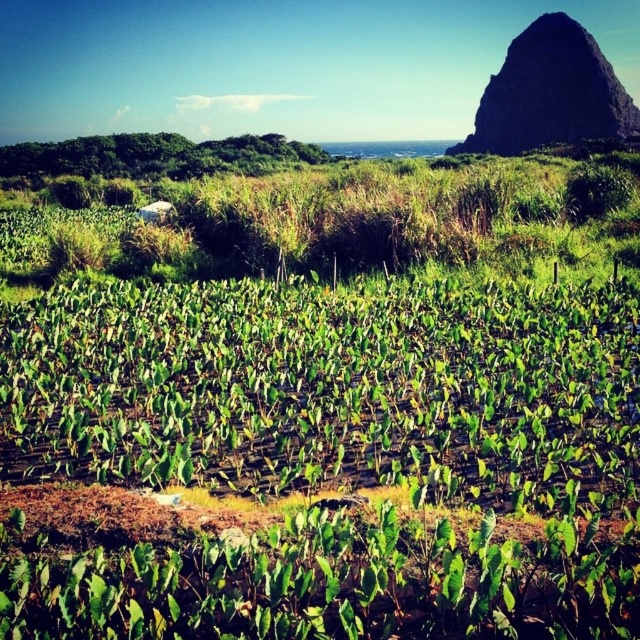
You are a farmer planning to plant new crops in the field. You notice the green leafy plants at center and the dark brown rocky peak at upper right. Which object is positioned higher in the image?

The dark brown rocky peak at upper right is positioned higher in the image than the green leafy plants at center.

You are a farmer standing at the edge of your field near the green leafy plants at center. You want to reach the dark brown rocky peak at upper right to check for potential erosion. Can you walk directly to it from your current position without needing to go around any obstacles?

The distance between the green leafy plants at center and the dark brown rocky peak at upper right is 99.03 meters. Since there are no obstacles mentioned in the scene description, you can walk directly to the peak.